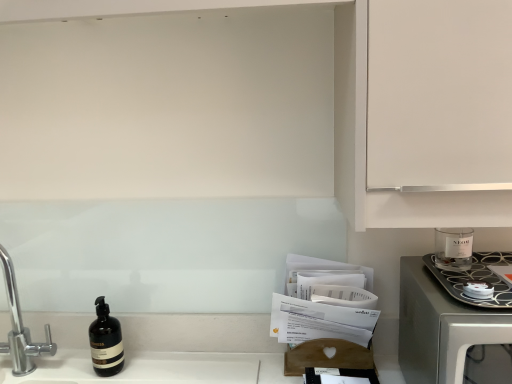
Question: From a real-world perspective, is chrome metallic faucet at left positioned over clear glass candle at right based on gravity?

Choices:
 (A) no
 (B) yes

Answer: (A)

Question: Does chrome metallic faucet at left have a greater width compared to clear glass candle at right?

Choices:
 (A) yes
 (B) no

Answer: (B)

Question: From the image's perspective, does chrome metallic faucet at left appear higher than clear glass candle at right?

Choices:
 (A) no
 (B) yes

Answer: (A)

Question: Considering the relative positions of chrome metallic faucet at left and clear glass candle at right in the image provided, is chrome metallic faucet at left to the right of clear glass candle at right from the viewer's perspective?

Choices:
 (A) yes
 (B) no

Answer: (B)

Question: Is chrome metallic faucet at left positioned behind clear glass candle at right?

Choices:
 (A) no
 (B) yes

Answer: (B)

Question: Does chrome metallic faucet at left have a larger size compared to clear glass candle at right?

Choices:
 (A) yes
 (B) no

Answer: (A)

Question: Can you confirm if matte black bottle at lower left is shorter than clear glass candle at right?

Choices:
 (A) no
 (B) yes

Answer: (A)

Question: Could clear glass candle at right be considered to be inside matte black bottle at lower left?

Choices:
 (A) no
 (B) yes

Answer: (A)

Question: Is matte black bottle at lower left next to clear glass candle at right?

Choices:
 (A) yes
 (B) no

Answer: (B)

Question: Is matte black bottle at lower left closer to camera compared to clear glass candle at right?

Choices:
 (A) yes
 (B) no

Answer: (B)

Question: From the image's perspective, is matte black bottle at lower left beneath clear glass candle at right?

Choices:
 (A) no
 (B) yes

Answer: (B)

Question: Can you confirm if matte black bottle at lower left is thinner than clear glass candle at right?

Choices:
 (A) yes
 (B) no

Answer: (A)

Question: Is satin silver microwave at right further to the viewer compared to chrome metallic faucet at left?

Choices:
 (A) yes
 (B) no

Answer: (B)